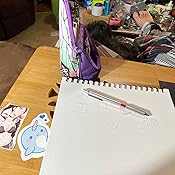
Locate an element on the screen. This screenshot has width=175, height=175. table surface is located at coordinates (29, 83).